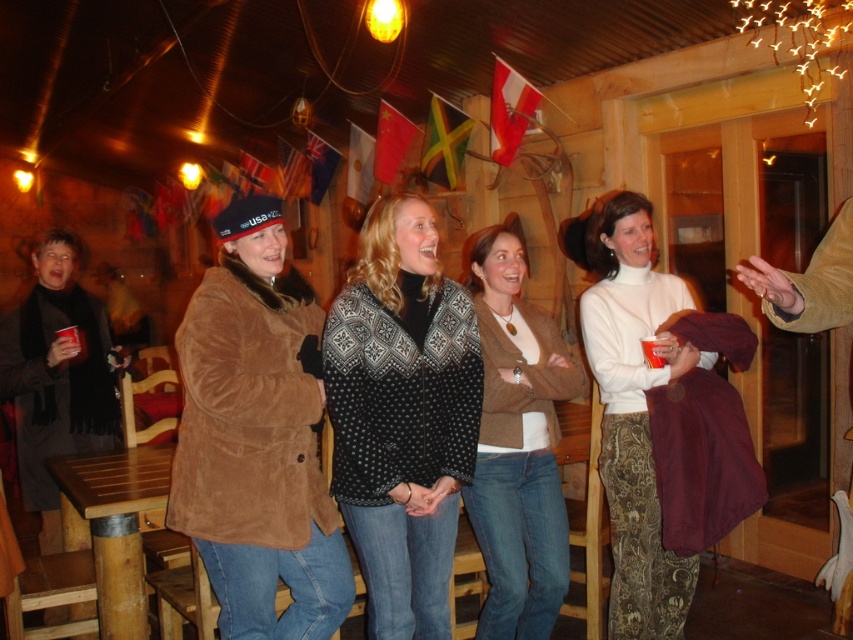
You are organizing a clothing display and need to arrange the suede jacket at center and the knit sweater at center side by side. Based on their sizes, which one should be placed on the left to accommodate their widths properly?

The suede jacket at center should be placed on the left since it is wider than the knit sweater at center, allowing enough space for both items in the display.

You are a photographer at the event and want to capture a photo of both the suede jacket at center and the white turtleneck sweater at center in the same frame. Which object should you focus on first to ensure both are in the shot?

The suede jacket at center is positioned on the left side of the white turtleneck sweater at center, so you should focus on the suede jacket at center first to ensure both are included in the frame.